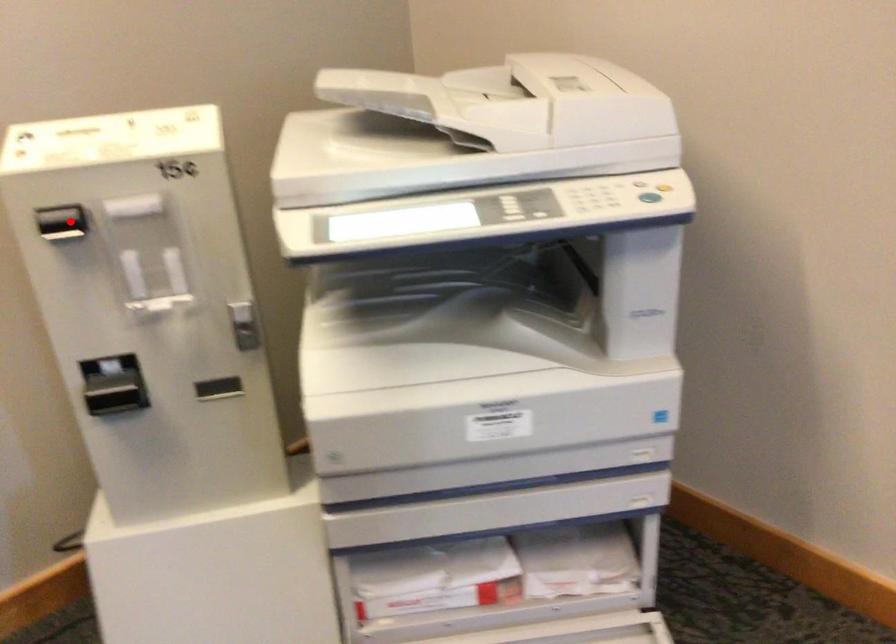
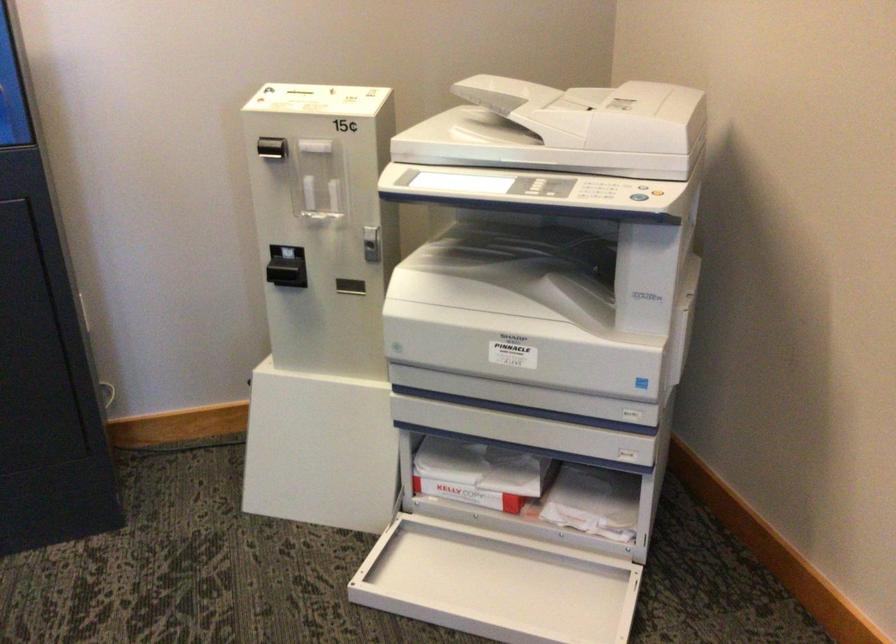
Find the pixel in the second image that matches the highlighted location in the first image.

(271, 147)